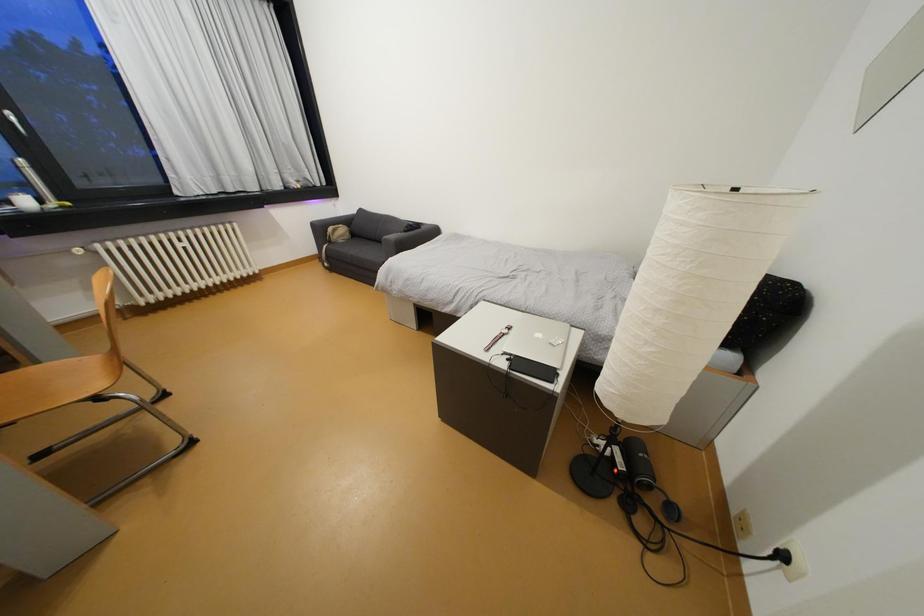
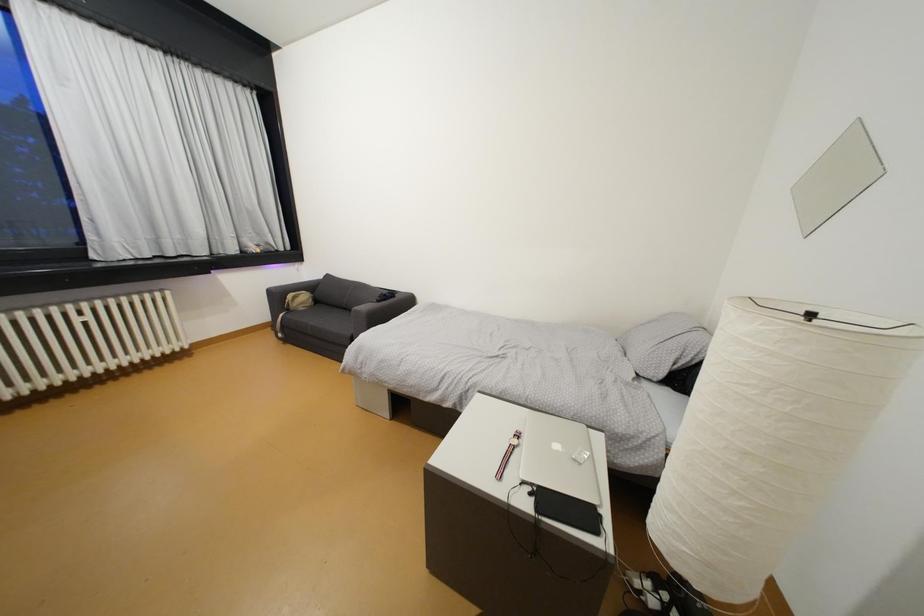
Question: The first image is from the beginning of the video and the second image is from the end. How did the camera likely rotate when shooting the video?

Choices:
 (A) Left
 (B) Right
 (C) Up
 (D) Down

Answer: (C)